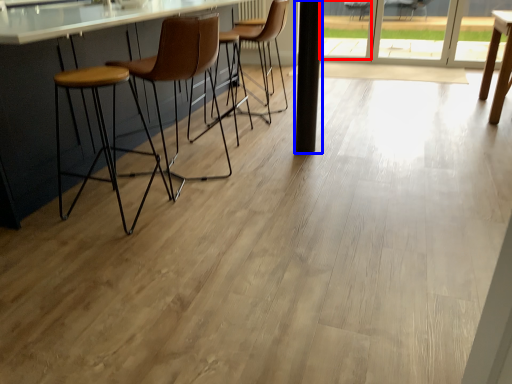
Question: Which object is further to the camera taking this photo, window (highlighted by a red box) or pillar (highlighted by a blue box)?

Choices:
 (A) window
 (B) pillar

Answer: (A)